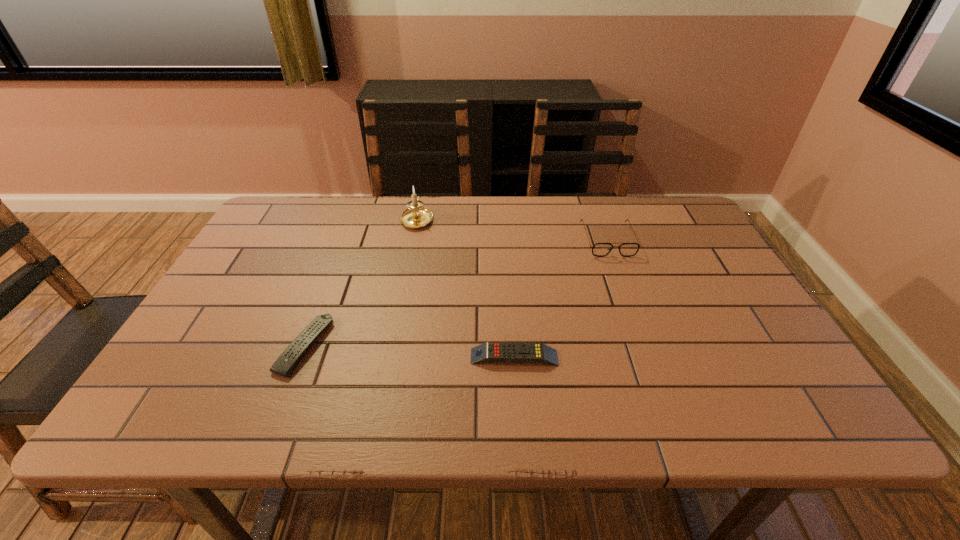
I want to click on candle holder at the far edge, so click(417, 216).

This screenshot has height=540, width=960. What are the coordinates of `sunglasses present at the far edge` in the screenshot? It's located at (599, 249).

Identify the location of vacant region at the far edge of the desktop. The width and height of the screenshot is (960, 540). (397, 222).

Locate an element on the screen. This screenshot has width=960, height=540. free region at the near edge of the desktop is located at coordinates (342, 418).

The height and width of the screenshot is (540, 960). In the image, there is a desktop. Find the location of `vacant space at the left edge`. vacant space at the left edge is located at coordinates (274, 253).

Identify the location of vacant position at the right edge of the desktop. (780, 354).

Locate an element on the screen. Image resolution: width=960 pixels, height=540 pixels. free point at the far right corner is located at coordinates (656, 238).

I want to click on free space at the near right corner of the desktop, so click(750, 392).

Identify the location of vacant region between the rightmost object and the left remote control. The image size is (960, 540). (456, 293).

Identify the location of free spot between the third object from left to right and the candle holder. (466, 288).